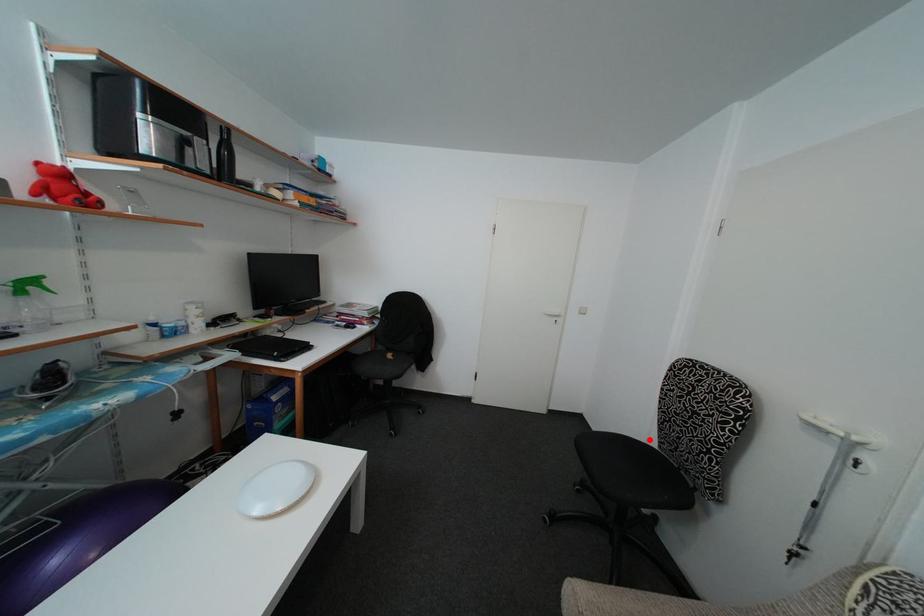
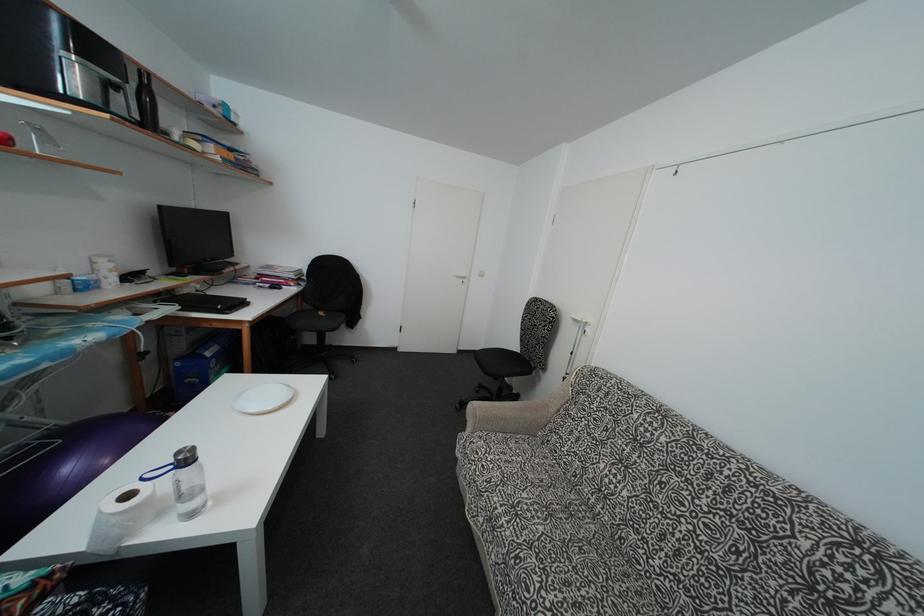
The point at the highlighted location is marked in the first image. Where is the corresponding point in the second image?

(517, 353)